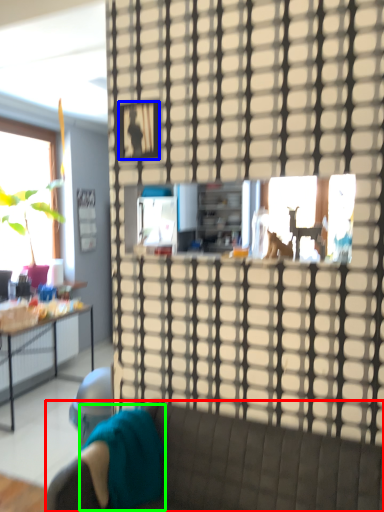
Question: Which object is positioned closest to studio couch (highlighted by a red box)? Select from picture frame (highlighted by a blue box) and pillow (highlighted by a green box).

Choices:
 (A) picture frame
 (B) pillow

Answer: (B)